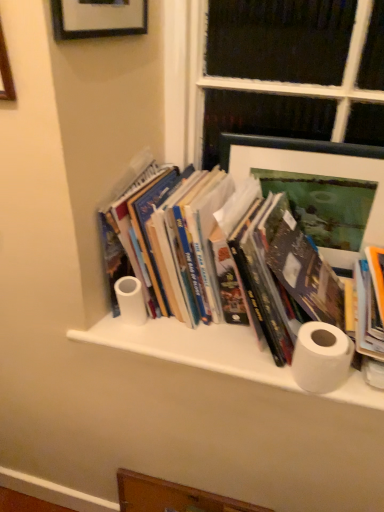
Locate an element on the screen. This screenshot has height=512, width=384. free space to the right of white matte toilet paper at center, the 2th toilet paper viewed from the right is located at coordinates (196, 335).